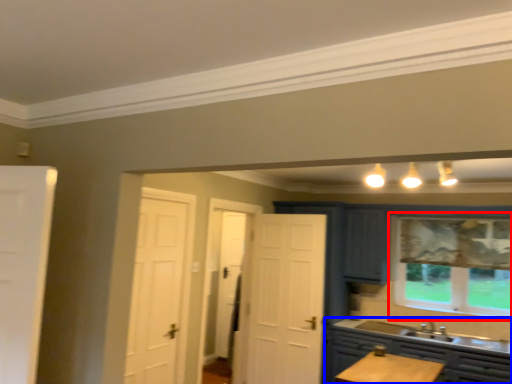
Question: Which point is further to the camera, window (highlighted by a red box) or cabinetry (highlighted by a blue box)?

Choices:
 (A) window
 (B) cabinetry

Answer: (A)